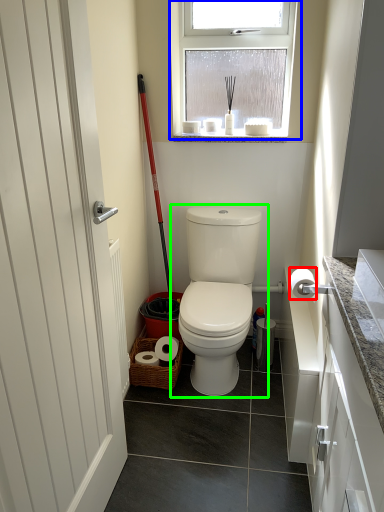
Question: Based on their relative distances, which object is nearer to toilet paper (highlighted by a red box)? Choose from window (highlighted by a blue box) and toilet (highlighted by a green box).

Choices:
 (A) window
 (B) toilet

Answer: (B)